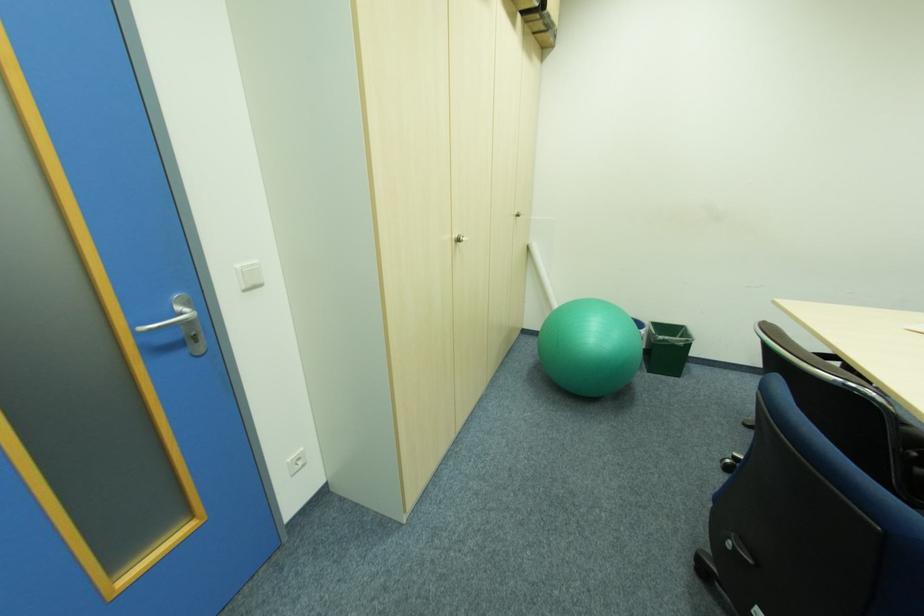
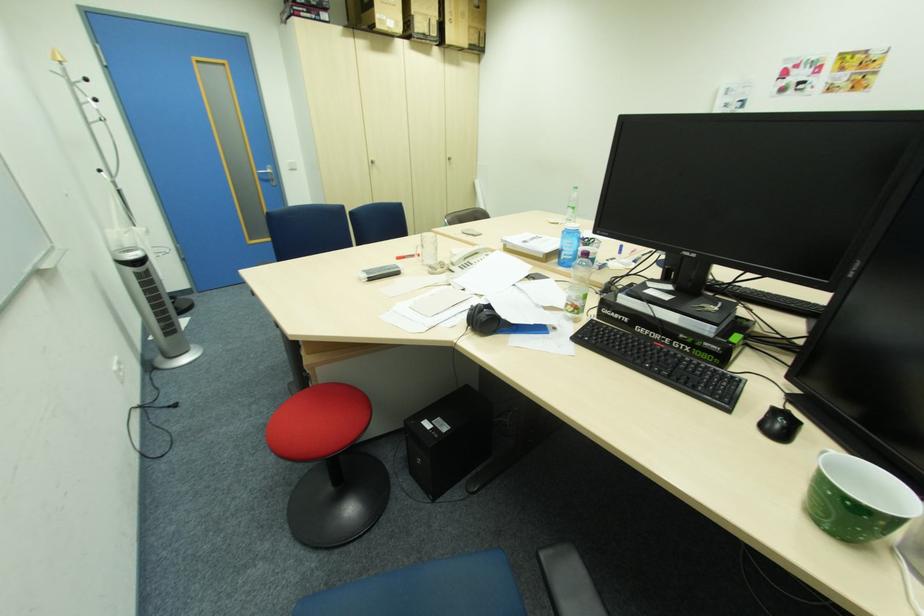
Question: I am providing you with two images of the same scene from different viewpoints. Which of the following objects are not visible in image2?

Choices:
 (A) green trash can
 (B) cardboard box
 (C) red chair sitting surface
 (D) circular wall handle

Answer: (A)